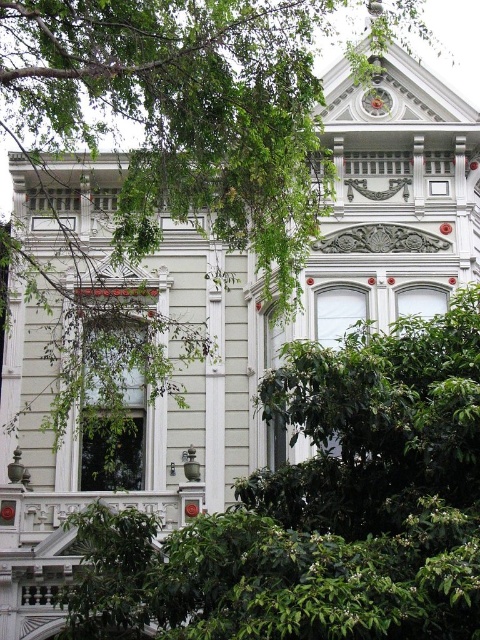
This screenshot has width=480, height=640. What do you see at coordinates (321, 508) in the screenshot? I see `green leafy tree at left` at bounding box center [321, 508].

Is point (365, 406) behind point (381, 90)?

That is False.

Which is behind, point (347, 630) or point (379, 92)?

Point (379, 92)

At what (x,y) coordinates should I click in order to perform the action: click on green leafy tree at left. Please return your answer as a coordinate pair (x, y). Looking at the image, I should click on (321, 508).

Is green leafy tree at center to the left of metallic clock at upper center from the viewer's perspective?

Yes, green leafy tree at center is to the left of metallic clock at upper center.

Is green leafy tree at center further to camera compared to metallic clock at upper center?

No, green leafy tree at center is in front of metallic clock at upper center.

Is point (96, 29) closer to camera compared to point (375, 93)?

That is True.

Where is `green leafy tree at center`? The height and width of the screenshot is (640, 480). green leafy tree at center is located at coordinates (183, 115).

Between green leafy tree at left and green leafy tree at center, which one appears on the left side from the viewer's perspective?

green leafy tree at center

Does green leafy tree at left have a lesser width compared to green leafy tree at center?

Indeed, green leafy tree at left has a lesser width compared to green leafy tree at center.

Is point (292, 596) positioned in front of point (67, 120)?

Yes, point (292, 596) is in front of point (67, 120).

I want to click on green leafy tree at left, so click(x=321, y=508).